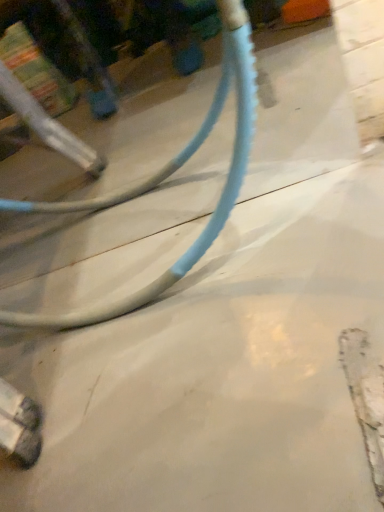
I want to click on smooth concrete at center, so click(x=220, y=371).

Describe the element at coordinates (220, 371) in the screenshot. Image resolution: width=384 pixels, height=512 pixels. I see `smooth concrete at center` at that location.

Identify the location of blue rubber hose at center. This screenshot has width=384, height=512. (169, 175).

This screenshot has width=384, height=512. What do you see at coordinates (169, 175) in the screenshot? I see `blue rubber hose at center` at bounding box center [169, 175].

This screenshot has height=512, width=384. I want to click on smooth concrete at center, so click(x=220, y=371).

Based on their positions, is smooth concrete at center located to the left or right of blue rubber hose at center?

In the image, smooth concrete at center appears on the right side of blue rubber hose at center.

Consider the image. Relative to blue rubber hose at center, is smooth concrete at center in front or behind?

Clearly, smooth concrete at center is behind blue rubber hose at center.

Between point (101, 262) and point (187, 255), which one is positioned behind?

The point (101, 262) is farther.

From the image's perspective, which one is positioned lower, smooth concrete at center or blue rubber hose at center?

From the image's view, smooth concrete at center is below.

From a real-world perspective, between smooth concrete at center and blue rubber hose at center, who is vertically higher?

blue rubber hose at center is physically above.

Considering the sizes of objects smooth concrete at center and blue rubber hose at center in the image provided, who is thinner, smooth concrete at center or blue rubber hose at center?

blue rubber hose at center is thinner.

Considering the sizes of smooth concrete at center and blue rubber hose at center in the image, is smooth concrete at center taller or shorter than blue rubber hose at center?

Considering their sizes, smooth concrete at center has less height than blue rubber hose at center.

Considering the sizes of objects smooth concrete at center and blue rubber hose at center in the image provided, who is smaller, smooth concrete at center or blue rubber hose at center?

With smaller size is smooth concrete at center.

Consider the image. Choose the correct answer: Is smooth concrete at center inside blue rubber hose at center or outside it?

smooth concrete at center is contained in blue rubber hose at center.

Is smooth concrete at center next to blue rubber hose at center?

smooth concrete at center and blue rubber hose at center are not in contact.

Could you tell me if smooth concrete at center is facing blue rubber hose at center?

No, smooth concrete at center is not facing towards blue rubber hose at center.

How different are the orientations of smooth concrete at center and blue rubber hose at center in degrees?

The angle between the facing direction of smooth concrete at center and the facing direction of blue rubber hose at center is 88.3 degrees.

Image resolution: width=384 pixels, height=512 pixels. I want to click on bicycle wheel lying above the smooth concrete at center (from the image's perspective), so click(169, 175).

Which is more to the left, blue rubber hose at center or smooth concrete at center?

Positioned to the left is blue rubber hose at center.

Who is more distant, blue rubber hose at center or smooth concrete at center?

smooth concrete at center is more distant.

Does point (113, 201) come closer to viewer compared to point (277, 348)?

No, (113, 201) is further to viewer.

From the image's perspective, is blue rubber hose at center below smooth concrete at center?

No, from the image's perspective, blue rubber hose at center is not below smooth concrete at center.

From a real-world perspective, is blue rubber hose at center on top of smooth concrete at center?

Indeed, from a real-world perspective, blue rubber hose at center stands above smooth concrete at center.

Considering the sizes of objects blue rubber hose at center and smooth concrete at center in the image provided, who is thinner, blue rubber hose at center or smooth concrete at center?

With smaller width is blue rubber hose at center.

Can you confirm if blue rubber hose at center is shorter than smooth concrete at center?

In fact, blue rubber hose at center may be taller than smooth concrete at center.

Considering the sizes of blue rubber hose at center and smooth concrete at center in the image, is blue rubber hose at center bigger or smaller than smooth concrete at center?

In the image, blue rubber hose at center appears to be larger than smooth concrete at center.

Is blue rubber hose at center not inside smooth concrete at center?

Indeed, blue rubber hose at center is completely outside smooth concrete at center.

Is blue rubber hose at center touching smooth concrete at center?

No, blue rubber hose at center is not touching smooth concrete at center.

Is blue rubber hose at center turned away from smooth concrete at center?

blue rubber hose at center does not have its back to smooth concrete at center.

What's the angular difference between blue rubber hose at center and smooth concrete at center's facing directions?

There is a 88.3-degree angle between the facing directions of blue rubber hose at center and smooth concrete at center.

How much distance is there between blue rubber hose at center and smooth concrete at center?

blue rubber hose at center is 8.91 inches from smooth concrete at center.

Where is `bicycle wheel in front of the smooth concrete at center`? The image size is (384, 512). bicycle wheel in front of the smooth concrete at center is located at coordinates (169, 175).

Image resolution: width=384 pixels, height=512 pixels. Find the location of `concrete below the blue rubber hose at center (from the image's perspective)`. concrete below the blue rubber hose at center (from the image's perspective) is located at coordinates (220, 371).

Locate an element on the screen. concrete that is under the blue rubber hose at center (from a real-world perspective) is located at coordinates (220, 371).